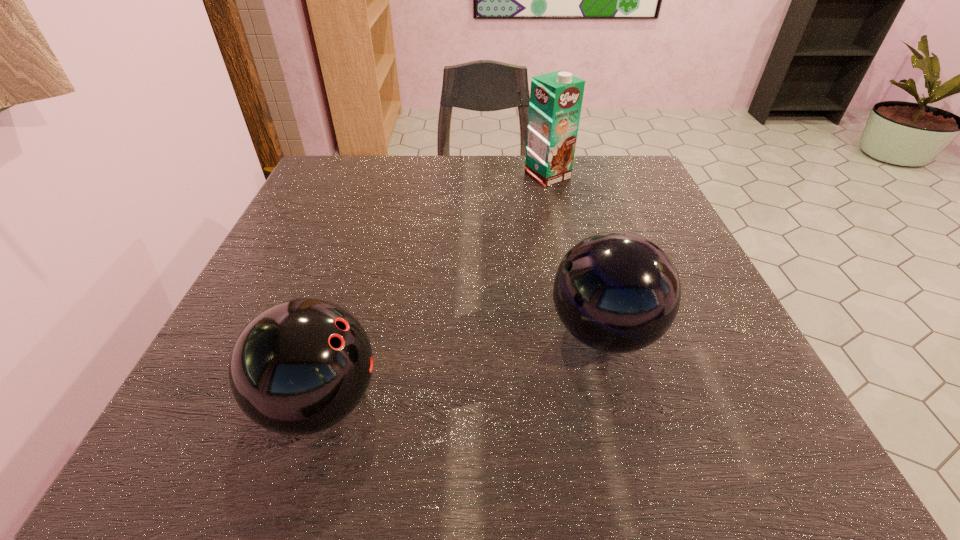
I want to click on the farthest object, so click(x=556, y=98).

Locate an element on the screen. Image resolution: width=960 pixels, height=540 pixels. carton is located at coordinates point(556,98).

Locate an element on the screen. the right bowling ball is located at coordinates (617, 292).

At what (x,y) coordinates should I click in order to perform the action: click on the leftmost object. Please return your answer as a coordinate pair (x, y). The image size is (960, 540). Looking at the image, I should click on (301, 366).

Where is `free region located on the front of the tallest object`? The width and height of the screenshot is (960, 540). free region located on the front of the tallest object is located at coordinates (573, 288).

Locate an element on the screen. Image resolution: width=960 pixels, height=540 pixels. free spot located on the side of the right bowling ball with the finger holes is located at coordinates (419, 332).

Where is `vacant space located on the side of the right bowling ball with the finger holes`? The width and height of the screenshot is (960, 540). vacant space located on the side of the right bowling ball with the finger holes is located at coordinates (395, 332).

The image size is (960, 540). I want to click on vacant space located 0.050m on the side of the right bowling ball with the finger holes, so click(x=517, y=332).

Locate an element on the screen. The width and height of the screenshot is (960, 540). blank space located 0.140m on the surface of the left bowling ball near the finger holes is located at coordinates (480, 402).

Where is `object that is positioned at the far edge`? The image size is (960, 540). object that is positioned at the far edge is located at coordinates tap(556, 98).